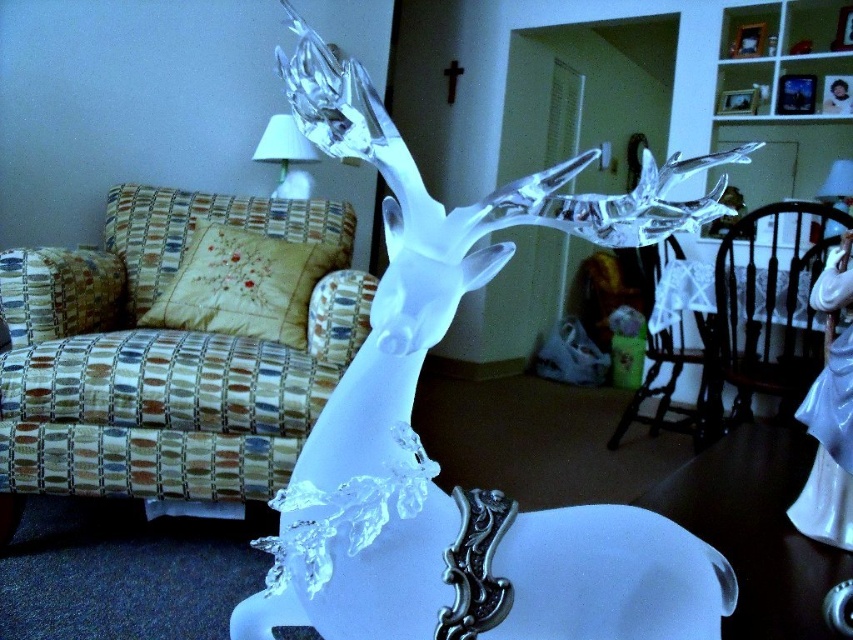
You are an interior designer trying to place a new rectangular shelf in the room. The shelf must be placed between the white frosted glass deer at center and the white glass lampshade at upper center. Given their widths, which object should the shelf be closer to to ensure it fits properly?

The white frosted glass deer at center is wider than the white glass lampshade at upper center. To ensure the shelf fits properly, it should be placed closer to the white glass lampshade at upper center since the deer takes up more space.

You are a guest in the room and want to avoid bumping your head on the white glass lampshade at upper center while walking around the white frosted glass deer at center. What should you be cautious of?

The white frosted glass deer at center is positioned under the white glass lampshade at upper center, so you should be cautious of the lampshade above the deer to avoid bumping your head.

You are an interior designer planning to place a new painting on the wall behind the white frosted glass deer at center. The painting has a width of 1.2 meters. Given the deer is at coordinates 0.722, 0.510 in the room, can you determine if there is enough space to the left of the deer to fit the painting without overlapping?

The white frosted glass deer at center is located at coordinates [434,461]. Since the painting is 1.2 meters wide, there should be sufficient space to the left of the deer to fit the painting without overlapping, provided the wall extends far enough in that direction.